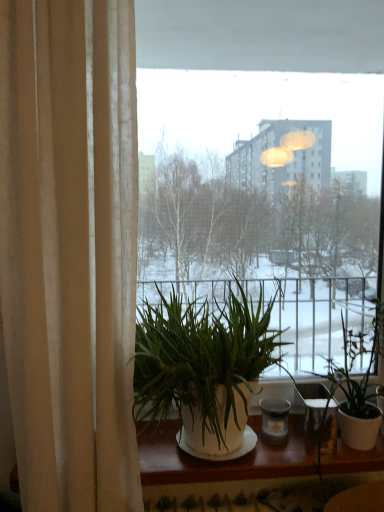
Question: From a real-world perspective, is green leafy plant at center, the 2th houseplant positioned from the right, above or below green leafy plant at right, the second houseplant from the left?

Choices:
 (A) above
 (B) below

Answer: (A)

Question: Would you say green leafy plant at center, marked as the first houseplant in a left-to-right arrangement, is to the left or to the right of green leafy plant at right, which ranks as the first houseplant in right-to-left order, in the picture?

Choices:
 (A) left
 (B) right

Answer: (A)

Question: Which object is positioned closest to the transparent glass window at center?

Choices:
 (A) white matte window sill at lower center
 (B) beige fabric curtain at left
 (C) green leafy plant at right, which ranks as the first houseplant in right-to-left order
 (D) green leafy plant at center, the 2th houseplant positioned from the right

Answer: (B)

Question: Which object is the farthest from the beige fabric curtain at left?

Choices:
 (A) green leafy plant at right, the second houseplant from the left
 (B) transparent glass window at center
 (C) white matte window sill at lower center
 (D) green leafy plant at center, the 2th houseplant positioned from the right

Answer: (B)